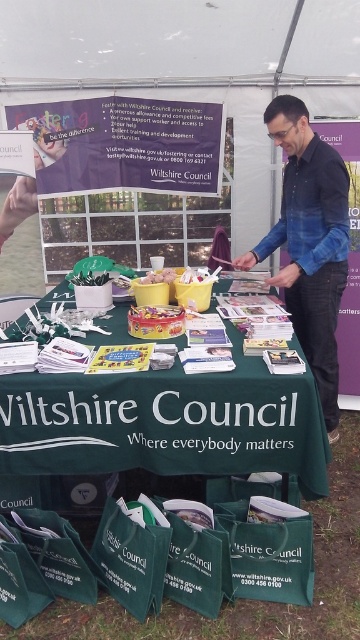
Who is more forward, (83, 424) or (325, 282)?

→ Point (83, 424)

This screenshot has width=360, height=640. I want to click on green fabric table at center, so click(x=165, y=422).

Between point (100, 408) and point (288, 310), which one is positioned behind?

Point (288, 310)

Find the location of a particular element. Image resolution: width=360 pixels, height=640 pixels. green fabric table at center is located at coordinates (165, 422).